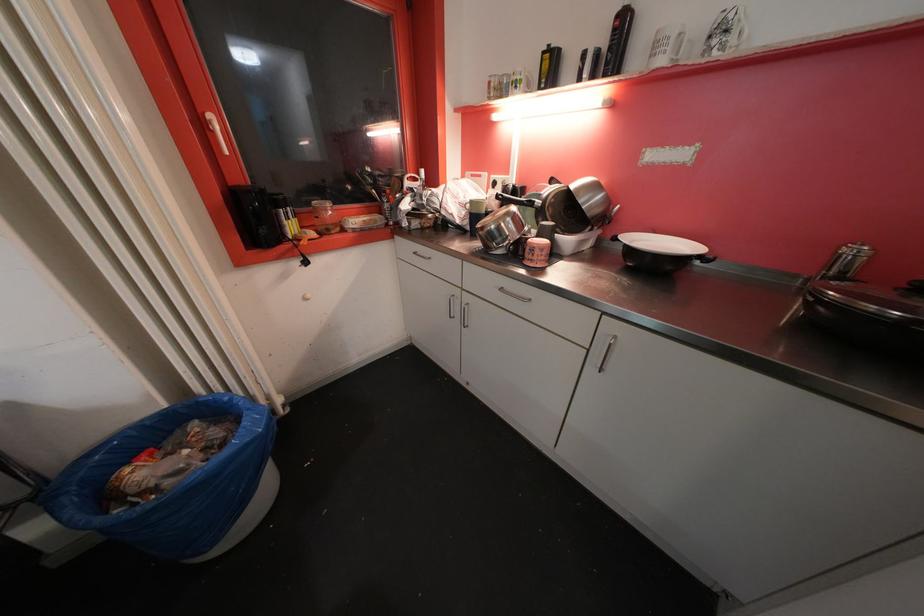
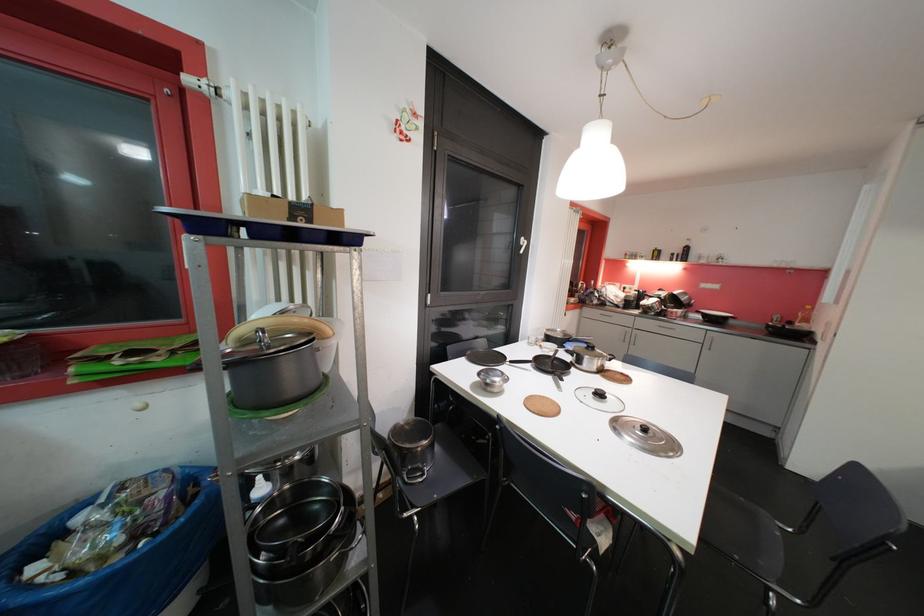
The images are taken continuously from a first-person perspective. In which direction are you moving?

The cameraman walked toward left, backward.